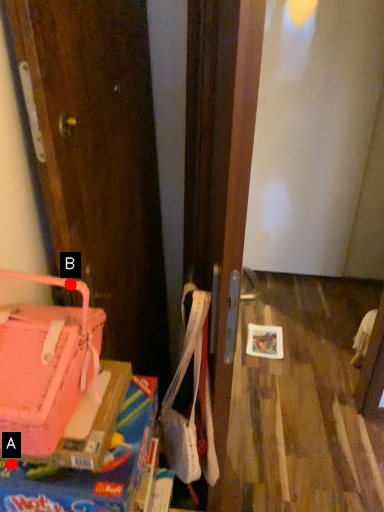
Question: Two points are circled on the image, labeled by A and B beside each circle. Which of the following is the farthest from the observer?

Choices:
 (A) A is further
 (B) B is further

Answer: (A)